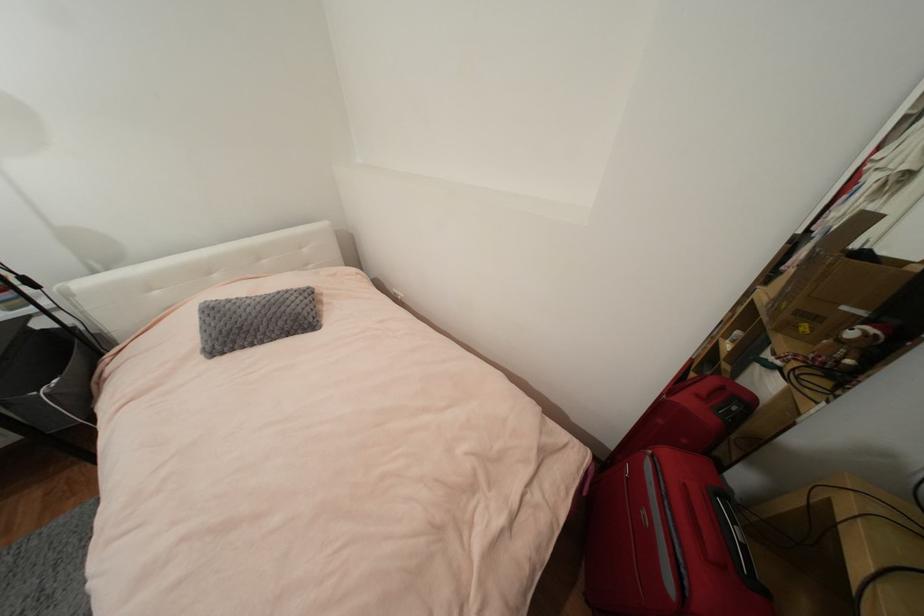
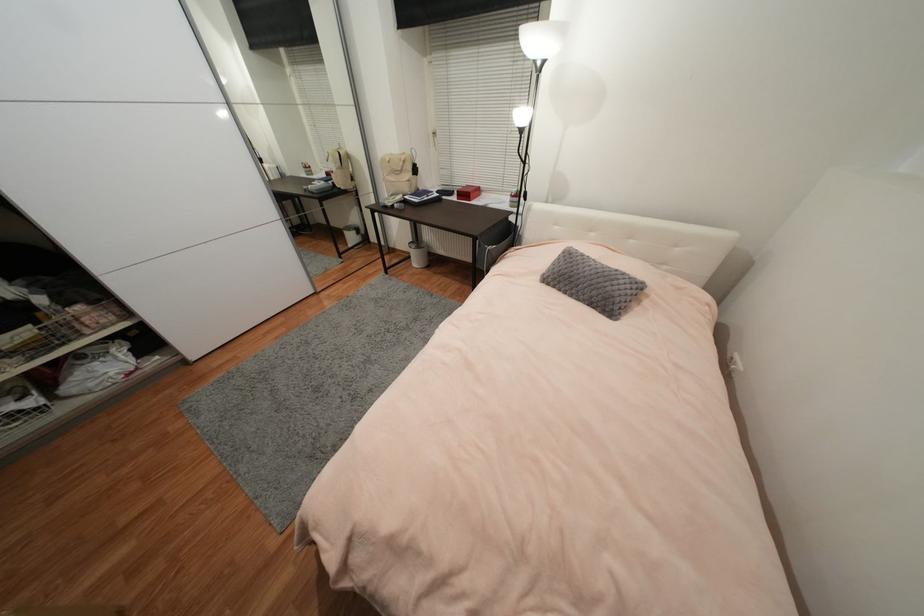
Find the pixel in the second image that matches point (257, 346) in the first image.

(569, 294)